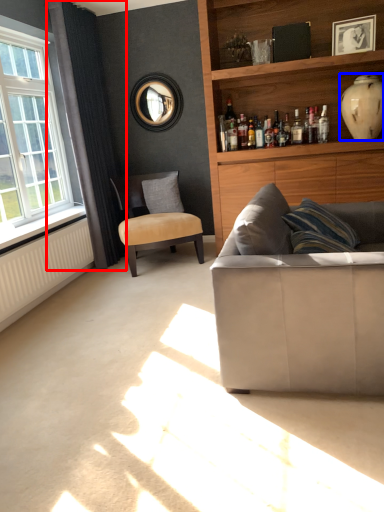
Question: Which object appears closest to the camera in this image, curtain (highlighted by a red box) or vase (highlighted by a blue box)?

Choices:
 (A) curtain
 (B) vase

Answer: (B)